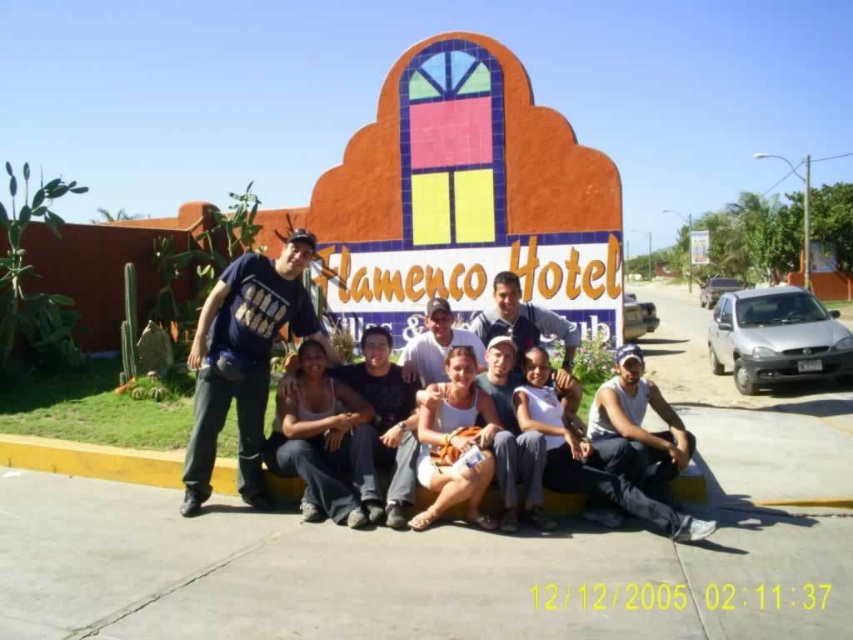
You are a photographer trying to capture a clear shot of the matte blue shirt at center and the white fabric sign at center. Which object should you focus on first if you want to ensure both are in focus without adjusting the camera settings?

The matte blue shirt at center is smaller than the white fabric sign at center, so focusing on the larger white fabric sign at center first would help maintain focus on both objects more effectively.